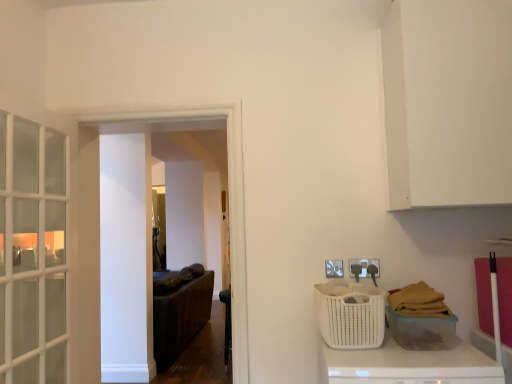
At what (x,y) coordinates should I click in order to perform the action: click on blank space above white matte counter top at lower right (from a real-world perspective). Please return your answer as a coordinate pair (x, y). This screenshot has width=512, height=384. Looking at the image, I should click on (407, 355).